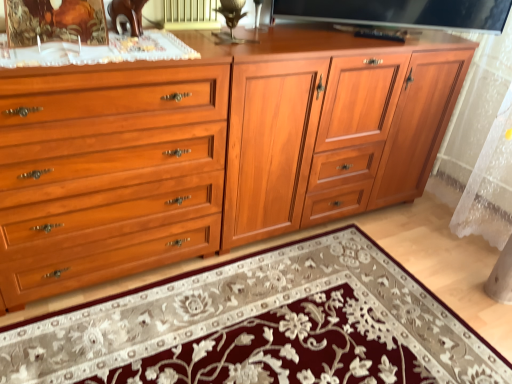
What do you see at coordinates (189, 15) in the screenshot? I see `matte gold radiator at upper center` at bounding box center [189, 15].

Identify the location of matte wood cabinet at center. (333, 127).

Describe the element at coordinates (55, 22) in the screenshot. I see `wooden picture frame at upper left` at that location.

What do you see at coordinates (108, 176) in the screenshot? The image size is (512, 384). I see `matte wood chest of drawers at left` at bounding box center [108, 176].

Find the location of `matte gold radiator at upper center`. matte gold radiator at upper center is located at coordinates (189, 15).

From the image's perspective, which object appears higher, matte gold radiator at upper center or satin black tv at upper center?

From the image's view, matte gold radiator at upper center is above.

From a real-world perspective, which is physically above, matte gold radiator at upper center or satin black tv at upper center?

matte gold radiator at upper center is physically above.

How many degrees apart are the facing directions of embroidered wool mat at center and matte wood chest of drawers at left?

0.234 degrees separate the facing orientations of embroidered wool mat at center and matte wood chest of drawers at left.

From a real-world perspective, who is located lower, embroidered wool mat at center or matte wood chest of drawers at left?

embroidered wool mat at center, from a real-world perspective.

Which object is positioned more to the left, embroidered wool mat at center or matte wood chest of drawers at left?

From the viewer's perspective, matte wood chest of drawers at left appears more on the left side.

Is embroidered wool mat at center bigger than matte wood chest of drawers at left?

No, embroidered wool mat at center is not bigger than matte wood chest of drawers at left.

Could you tell me if wooden picture frame at upper left is turned towards matte wood cabinet at center?

No, wooden picture frame at upper left is not facing towards matte wood cabinet at center.

Are wooden picture frame at upper left and matte wood cabinet at center located far from each other?

wooden picture frame at upper left is far away from matte wood cabinet at center.

Who is shorter, wooden picture frame at upper left or matte wood cabinet at center?

Standing shorter between the two is wooden picture frame at upper left.

Where is `picture frame above the matte wood cabinet at center (from a real-world perspective)`? picture frame above the matte wood cabinet at center (from a real-world perspective) is located at coordinates (55, 22).

Can you confirm if wooden picture frame at upper left is bigger than satin black tv at upper center?

Indeed, wooden picture frame at upper left has a larger size compared to satin black tv at upper center.

Based on the photo, could satin black tv at upper center be considered to be inside wooden picture frame at upper left?

That's incorrect, satin black tv at upper center is not inside wooden picture frame at upper left.

How many degrees apart are the facing directions of wooden picture frame at upper left and satin black tv at upper center?

The angular difference between wooden picture frame at upper left and satin black tv at upper center is 13.5 degrees.

Does wooden picture frame at upper left appear on the right side of satin black tv at upper center?

In fact, wooden picture frame at upper left is to the left of satin black tv at upper center.

From a real-world perspective, is matte gold radiator at upper center positioned above or below matte wood chest of drawers at left?

matte gold radiator at upper center is situated higher than matte wood chest of drawers at left in the real world.

From their relative heights in the image, would you say matte gold radiator at upper center is taller or shorter than matte wood chest of drawers at left?

Considering their sizes, matte gold radiator at upper center has less height than matte wood chest of drawers at left.

Between matte gold radiator at upper center and matte wood chest of drawers at left, which one has smaller width?

Thinner between the two is matte gold radiator at upper center.

Which point is more distant from viewer, (197, 4) or (96, 251)?

Point (197, 4)

Locate an element on the screen. This screenshot has height=384, width=512. picture frame on the left of matte wood cabinet at center is located at coordinates (55, 22).

Considering the sizes of objects matte wood cabinet at center and wooden picture frame at upper left in the image provided, who is bigger, matte wood cabinet at center or wooden picture frame at upper left?

matte wood cabinet at center.

Is matte wood cabinet at center positioned far away from wooden picture frame at upper left?

matte wood cabinet at center is far away from wooden picture frame at upper left.

From a real-world perspective, does matte wood cabinet at center stand above wooden picture frame at upper left?

No, from a real-world perspective, matte wood cabinet at center is not over wooden picture frame at upper left

Where is `television above the embroidered wool mat at center (from the image's perspective)`? television above the embroidered wool mat at center (from the image's perspective) is located at coordinates (401, 13).

Would you say satin black tv at upper center contains embroidered wool mat at center?

No, embroidered wool mat at center is not inside satin black tv at upper center.

Which point is more distant from viewer, [456,17] or [386,344]?

Positioned behind is point [456,17].

Where is `television on the right of matte gold radiator at upper center`? The height and width of the screenshot is (384, 512). television on the right of matte gold radiator at upper center is located at coordinates (401, 13).

Locate an element on the screen. The height and width of the screenshot is (384, 512). chest of drawers behind the embroidered wool mat at center is located at coordinates (108, 176).

Looking at this image, when comparing their distances from embroidered wool mat at center, does matte gold radiator at upper center or matte wood chest of drawers at left seem further?

matte gold radiator at upper center.

Based on their spatial positions, is matte gold radiator at upper center or matte wood cabinet at center closer to embroidered wool mat at center?

matte wood cabinet at center is closer to embroidered wool mat at center.

From the image, which object appears to be nearer to satin black tv at upper center, wooden picture frame at upper left or matte wood cabinet at center?

Based on the image, matte wood cabinet at center appears to be nearer to satin black tv at upper center.

Considering their positions, is matte wood chest of drawers at left positioned closer to matte wood cabinet at center than matte gold radiator at upper center?

matte wood chest of drawers at left.

When comparing their distances from satin black tv at upper center, does embroidered wool mat at center or wooden picture frame at upper left seem further?

embroidered wool mat at center.

Looking at the image, which one is located further to embroidered wool mat at center, wooden picture frame at upper left or matte gold radiator at upper center?

Based on the image, matte gold radiator at upper center appears to be further to embroidered wool mat at center.

Looking at the image, which one is located further to embroidered wool mat at center, satin black tv at upper center or matte wood chest of drawers at left?

satin black tv at upper center is further to embroidered wool mat at center.

When comparing their distances from embroidered wool mat at center, does satin black tv at upper center or matte gold radiator at upper center seem further?

The object further to embroidered wool mat at center is satin black tv at upper center.

Find the location of a particular element. This screenshot has height=384, width=512. tv cabinet between matte gold radiator at upper center and satin black tv at upper center in the horizontal direction is located at coordinates (333, 127).

You are a GUI agent. You are given a task and a screenshot of the screen. Output one action in this format:
    pyautogui.click(x=<x>, y=<y>)
    Task: Click on the radiator between matte wood chest of drawers at left and matte wood cabinet at center
    The width and height of the screenshot is (512, 384).
    Given the screenshot: What is the action you would take?
    pyautogui.click(x=189, y=15)

Where is `chest of drawers between wooden picture frame at upper left and matte wood cabinet at center`? The image size is (512, 384). chest of drawers between wooden picture frame at upper left and matte wood cabinet at center is located at coordinates (108, 176).

Where is `picture frame between satin black tv at upper center and embroidered wool mat at center in the vertical direction`? The image size is (512, 384). picture frame between satin black tv at upper center and embroidered wool mat at center in the vertical direction is located at coordinates (55, 22).